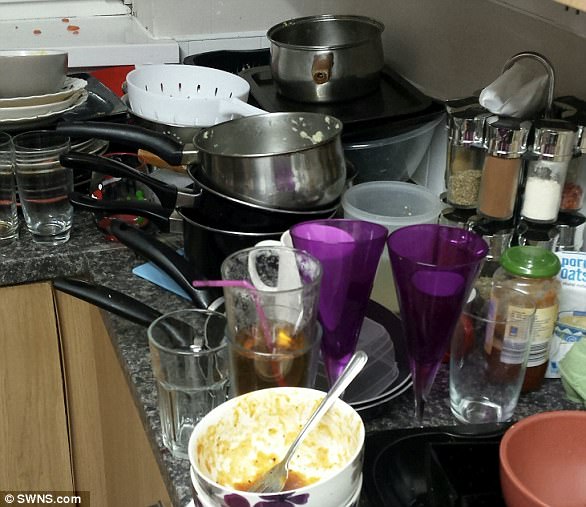
I want to click on dirty fork, so click(310, 423).